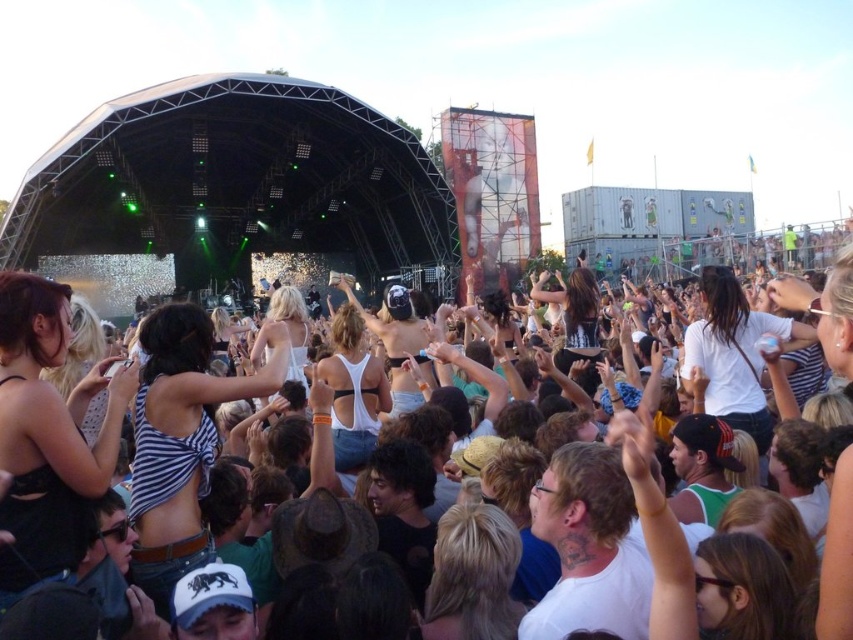
You are a photographer at the concert and want to capture the white matte bikini top at center without the white fabric crowd at center blocking it. Is the crowd in front of or behind the bikini top?

The white fabric crowd at center is positioned over the white matte bikini top at center, meaning the crowd is in front of the bikini top.

You are a photographer trying to capture the white fabric crowd at center and the white matte bikini top at center in a single shot. Which object should you focus on first to ensure both are in sharp focus?

You should focus on the white fabric crowd at center first since it is closer to the viewer than the white matte bikini top at center, ensuring both will be in focus when using a proper aperture setting.